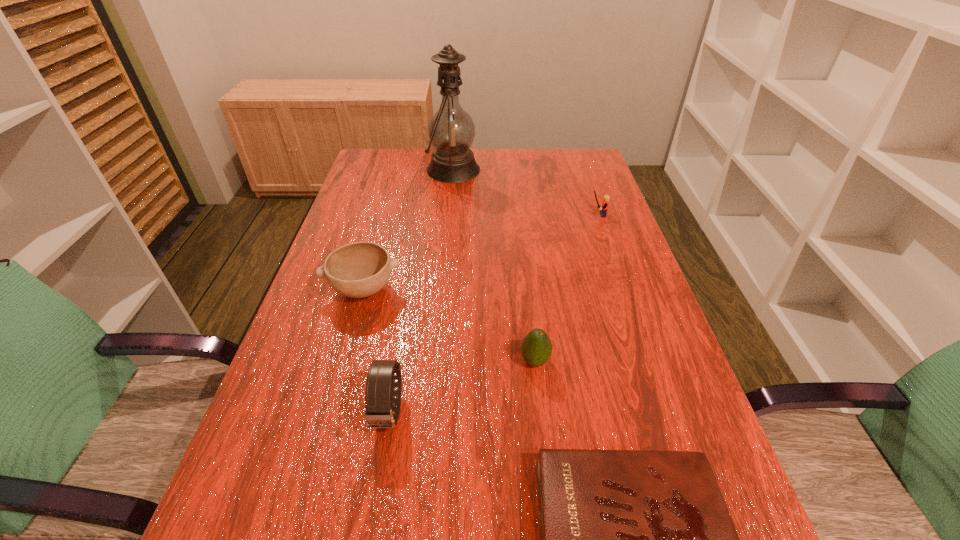
What are the coordinates of `free spot located 0.370m on the front-facing side of the fifth nearest object` in the screenshot? It's located at (459, 215).

Where is `free point located on the front-facing side of the fifth nearest object`? free point located on the front-facing side of the fifth nearest object is located at coordinates (466, 215).

At what (x,y) coordinates should I click in order to perform the action: click on vacant space located on the right of the fourth farthest object. Please return your answer as a coordinate pair (x, y). This screenshot has height=540, width=960. Looking at the image, I should click on (585, 361).

Identify the location of vacant area situated on the right of the bowl. pyautogui.click(x=469, y=289).

Locate an element on the screen. The image size is (960, 540). object at the far edge is located at coordinates (451, 130).

You are a GUI agent. You are given a task and a screenshot of the screen. Output one action in this format:
    pyautogui.click(x=<x>, y=<y>)
    Task: Click on the object located in the left edge section of the desktop
    
    Given the screenshot: What is the action you would take?
    pyautogui.click(x=360, y=269)

Find the location of a particular element. The height and width of the screenshot is (540, 960). object positioned at the right edge is located at coordinates (605, 203).

In the image, there is a desktop. Where is `blank space at the far edge`? The height and width of the screenshot is (540, 960). blank space at the far edge is located at coordinates (516, 184).

Image resolution: width=960 pixels, height=540 pixels. In the image, there is a desktop. Find the location of `vacant space at the left edge`. vacant space at the left edge is located at coordinates (366, 206).

In the image, there is a desktop. Identify the location of free space at the right edge. This screenshot has height=540, width=960. (630, 266).